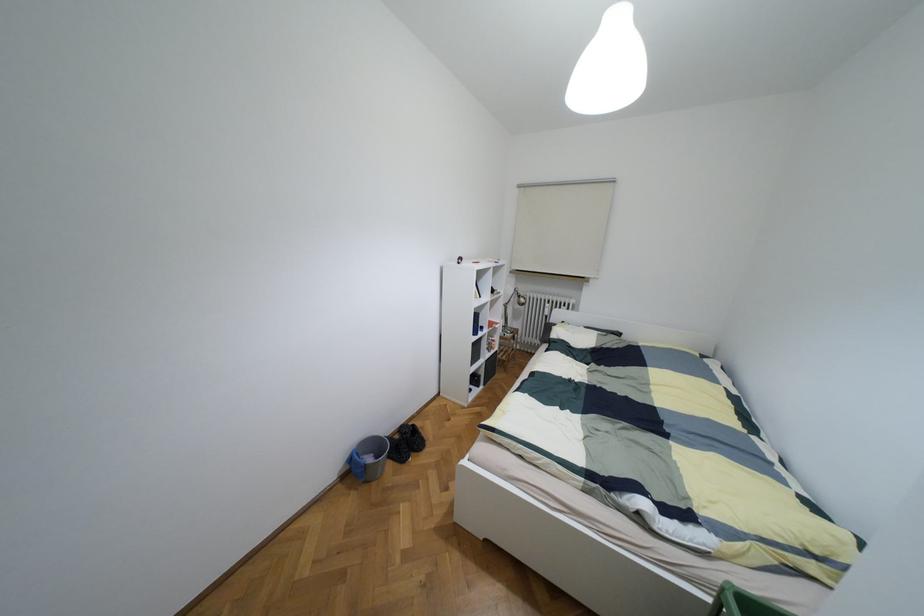
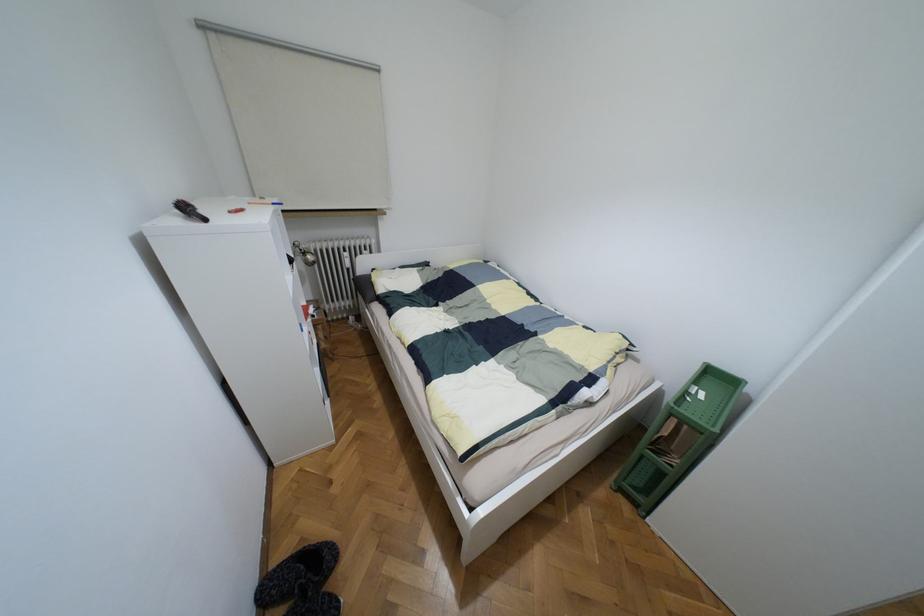
First-person continuous shooting, in which direction is the camera rotating?

The camera's rotation is toward right-down.